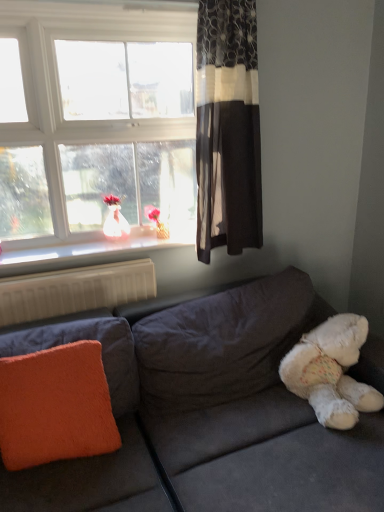
Question: Is dark floral-patterned curtain at upper right completely or partially outside of white plastic radiator at lower left?

Choices:
 (A) no
 (B) yes

Answer: (B)

Question: From a real-world perspective, is dark floral-patterned curtain at upper right on top of white plastic radiator at lower left?

Choices:
 (A) yes
 (B) no

Answer: (A)

Question: From the image's perspective, does dark floral-patterned curtain at upper right appear lower than white plastic radiator at lower left?

Choices:
 (A) yes
 (B) no

Answer: (B)

Question: Is dark floral-patterned curtain at upper right positioned in front of white plastic radiator at lower left?

Choices:
 (A) no
 (B) yes

Answer: (B)

Question: Is dark floral-patterned curtain at upper right smaller than white plastic radiator at lower left?

Choices:
 (A) yes
 (B) no

Answer: (B)

Question: Which is correct: white plastic radiator at lower left is inside velvet gray couch at lower right, or outside of it?

Choices:
 (A) outside
 (B) inside

Answer: (A)

Question: Would you say white plastic radiator at lower left is to the left or to the right of velvet gray couch at lower right in the picture?

Choices:
 (A) right
 (B) left

Answer: (B)

Question: Does point (72, 297) appear closer or farther from the camera than point (342, 467)?

Choices:
 (A) closer
 (B) farther

Answer: (B)

Question: Considering the positions of white plastic radiator at lower left and velvet gray couch at lower right in the image, is white plastic radiator at lower left bigger or smaller than velvet gray couch at lower right?

Choices:
 (A) small
 (B) big

Answer: (A)

Question: Looking at the image, does white glossy window sill at upper left seem bigger or smaller compared to orange fuzzy pillow at lower left?

Choices:
 (A) big
 (B) small

Answer: (B)

Question: Is white glossy window sill at upper left taller or shorter than orange fuzzy pillow at lower left?

Choices:
 (A) short
 (B) tall

Answer: (A)

Question: Based on their positions, is white glossy window sill at upper left located to the left or right of orange fuzzy pillow at lower left?

Choices:
 (A) left
 (B) right

Answer: (B)

Question: From the image's perspective, is white glossy window sill at upper left positioned above or below orange fuzzy pillow at lower left?

Choices:
 (A) above
 (B) below

Answer: (A)

Question: Would you say white fluffy teddy bear at lower right is inside or outside orange fuzzy pillow at lower left?

Choices:
 (A) outside
 (B) inside

Answer: (A)

Question: From a real-world perspective, is white fluffy teddy bear at lower right physically located above or below orange fuzzy pillow at lower left?

Choices:
 (A) below
 (B) above

Answer: (A)